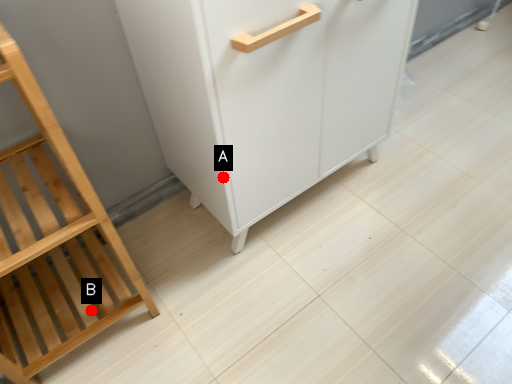
Question: Two points are circled on the image, labeled by A and B beside each circle. Which point appears farthest from the camera in this image?

Choices:
 (A) A is further
 (B) B is further

Answer: (B)